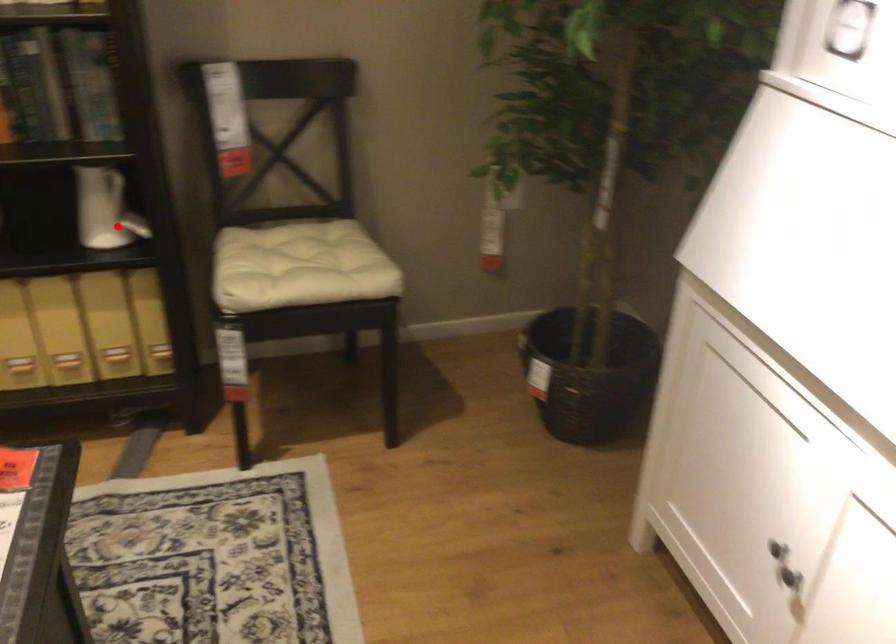
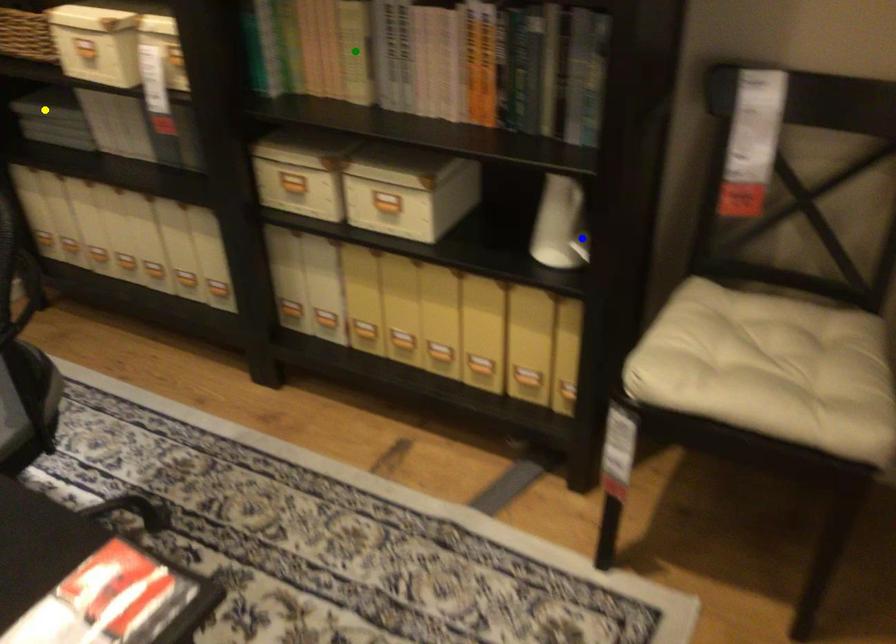
Question: I am providing you with two images of the same scene from different viewpoints. A red point is marked on the first image. You are given multiple points on the second image. Which point in image 2 represents the same 3d spot as the red point in image 1?

Choices:
 (A) blue point
 (B) yellow point
 (C) green point

Answer: (A)